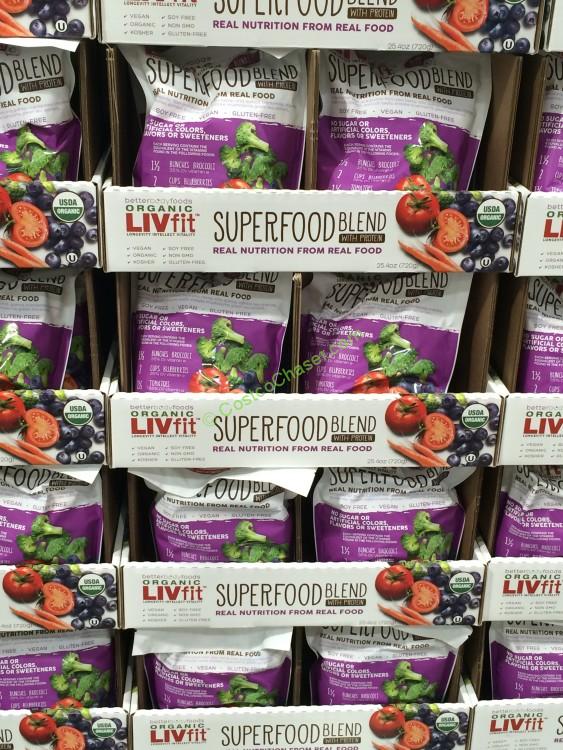
Where is `box`? This screenshot has height=750, width=563. box is located at coordinates (205, 615).